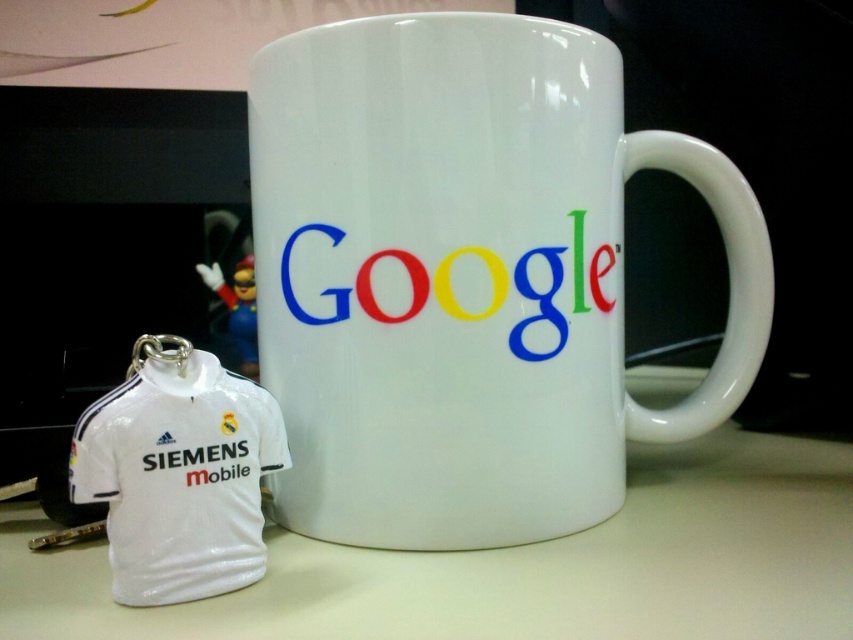
Question: Does white glossy mug at center appear on the right side of white matte table at lower center?

Choices:
 (A) no
 (B) yes

Answer: (B)

Question: Which point is farther to the camera?

Choices:
 (A) smooth glossy google logo at center
 (B) white glossy jersey at lower left
 (C) white matte table at lower center
 (D) white glossy mug at center

Answer: (A)

Question: In this image, where is white matte table at lower center located relative to smooth glossy google logo at center?

Choices:
 (A) right
 (B) left

Answer: (A)

Question: Does white matte table at lower center have a smaller size compared to white glossy jersey at lower left?

Choices:
 (A) yes
 (B) no

Answer: (B)

Question: Among these objects, which one is nearest to the camera?

Choices:
 (A) white glossy mug at center
 (B) smooth glossy google logo at center

Answer: (A)

Question: Which of the following is the farthest from the observer?

Choices:
 (A) (556, 422)
 (B) (532, 353)
 (C) (842, 528)

Answer: (C)